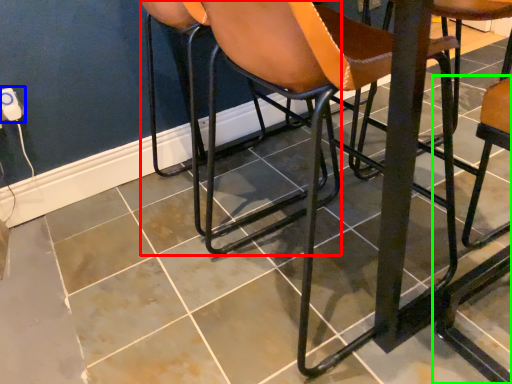
Question: Considering the real-world distances, which object is farthest from chair (highlighted by a red box)? electric outlet (highlighted by a blue box) or chair (highlighted by a green box)?

Choices:
 (A) electric outlet
 (B) chair

Answer: (A)